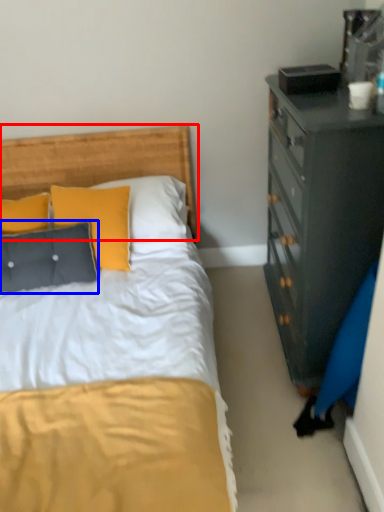
Question: Which object appears farthest to the camera in this image, headboard (highlighted by a red box) or pillow (highlighted by a blue box)?

Choices:
 (A) headboard
 (B) pillow

Answer: (A)